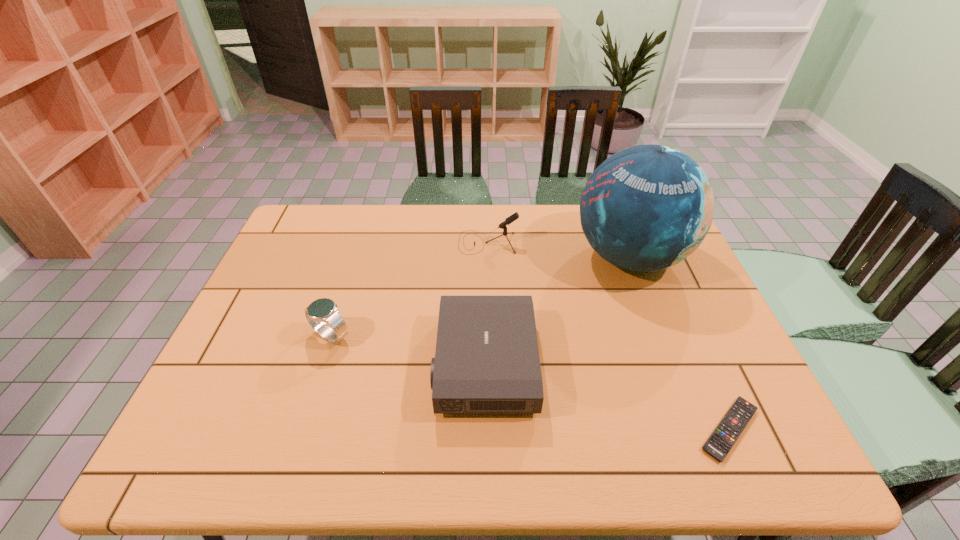
In order to click on vacant space that is in between the projector and the watch in this screenshot , I will do `click(408, 350)`.

Locate which object ranks second in proximity to the projector. Please provide its 2D coordinates. Your answer should be formatted as a tuple, i.e. [(x, y)], where the tuple contains the x and y coordinates of a point satisfying the conditions above.

[(322, 310)]

Select which object appears as the second closest to the microphone. Please provide its 2D coordinates. Your answer should be formatted as a tuple, i.e. [(x, y)], where the tuple contains the x and y coordinates of a point satisfying the conditions above.

[(487, 361)]

Identify the location of free space that satisfies the following two spatial constraints: 1. on the front-facing side of the shortest object; 2. on the right side of the projector. (486, 429).

The height and width of the screenshot is (540, 960). Find the location of `vacant region that satisfies the following two spatial constraints: 1. on the stand of the microphone; 2. on the left side of the shortest object`. vacant region that satisfies the following two spatial constraints: 1. on the stand of the microphone; 2. on the left side of the shortest object is located at coordinates (492, 429).

Identify the location of free region that satisfies the following two spatial constraints: 1. on the stand of the globe; 2. on the left side of the microphone. (489, 257).

In order to click on vacant area that satisfies the following two spatial constraints: 1. on the stand of the remote control; 2. on the left side of the microphone in this screenshot , I will do `click(492, 429)`.

This screenshot has height=540, width=960. Find the location of `free spot that satisfies the following two spatial constraints: 1. on the stand of the shortest object; 2. on the left side of the microphone`. free spot that satisfies the following two spatial constraints: 1. on the stand of the shortest object; 2. on the left side of the microphone is located at coordinates click(x=492, y=429).

At what (x,y) coordinates should I click in order to perform the action: click on vacant region that satisfies the following two spatial constraints: 1. on the front-facing side of the projector; 2. on the left side of the shortest object. Please return your answer as a coordinate pair (x, y). The image size is (960, 540). Looking at the image, I should click on click(486, 429).

Find the location of `vacant area that satisfies the following two spatial constraints: 1. on the stand of the globe; 2. on the right side of the microphone`. vacant area that satisfies the following two spatial constraints: 1. on the stand of the globe; 2. on the right side of the microphone is located at coordinates [489, 257].